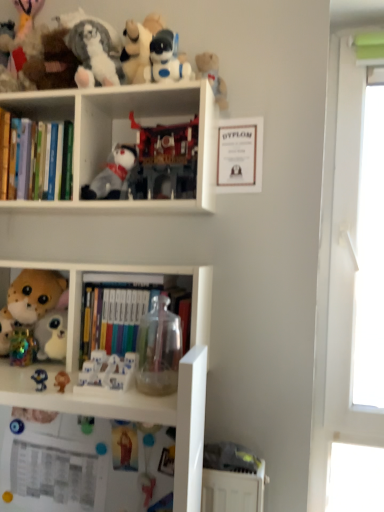
The image size is (384, 512). Find the location of `white plastic robot at upper center, the second toy positioned from the top`. white plastic robot at upper center, the second toy positioned from the top is located at coordinates (165, 59).

The height and width of the screenshot is (512, 384). What do you see at coordinates (111, 174) in the screenshot? I see `white plush toy at center, the eighth toy in the bottom-to-top sequence` at bounding box center [111, 174].

What do you see at coordinates (22, 345) in the screenshot? Image resolution: width=384 pixels, height=512 pixels. I see `shiny metallic piggy bank at lower left, the 5th toy ordered from the bottom` at bounding box center [22, 345].

The width and height of the screenshot is (384, 512). I want to click on shiny metallic piggy bank at lower left, the 7th toy viewed from the top, so click(x=22, y=345).

You are a GUI agent. You are given a task and a screenshot of the screen. Output one action in this format:
    pyautogui.click(x=<x>, y=<y>)
    Task: Click on the fluffy plush toy at left, the seventh toy from the bottom
    
    Given the screenshot: What is the action you would take?
    pyautogui.click(x=38, y=311)

Is white plastic bookshelf at upper center positioned before matte plastic toy at lower center, the first toy positioned from the bottom?

Yes, it is.

Which is behind, point (165, 84) or point (145, 504)?

The point (165, 84) is farther from the camera.

Is white plastic bookshelf at upper center smaller than matte plastic toy at lower center, marked as the 11th toy in a top-to-bottom arrangement?

No, white plastic bookshelf at upper center is not smaller than matte plastic toy at lower center, marked as the 11th toy in a top-to-bottom arrangement.

Is white plastic bookshelf at upper center not within matte plastic toy at lower center, the first toy positioned from the bottom?

Yes.

Does fluffy plush toy at left, the seventh toy from the bottom, lie in front of plastic matte robot at center, the third toy when ordered from top to bottom?

No, the depth of fluffy plush toy at left, the seventh toy from the bottom, is greater than that of plastic matte robot at center, the third toy when ordered from top to bottom.

Does fluffy plush toy at left, the seventh toy from the bottom, turn towards plastic matte robot at center, the third toy when ordered from top to bottom?

No, fluffy plush toy at left, the seventh toy from the bottom, is not turned towards plastic matte robot at center, the third toy when ordered from top to bottom.

Between point (54, 354) and point (153, 181), which one is positioned in front?

The point (153, 181) is closer.

How distant is fluffy plush toy at left, the seventh toy from the bottom, from plastic matte robot at center, the third toy when ordered from top to bottom?

A distance of 17.22 inches exists between fluffy plush toy at left, the seventh toy from the bottom, and plastic matte robot at center, the third toy when ordered from top to bottom.

Considering the sizes of objects matte plastic toy at lower center, the first toy positioned from the bottom, and white plastic bookshelf at upper center in the image provided, who is shorter, matte plastic toy at lower center, the first toy positioned from the bottom, or white plastic bookshelf at upper center?

matte plastic toy at lower center, the first toy positioned from the bottom, is shorter.

Considering the relative positions of matte plastic toy at lower center, marked as the 11th toy in a top-to-bottom arrangement, and white plastic bookshelf at upper center in the image provided, is matte plastic toy at lower center, marked as the 11th toy in a top-to-bottom arrangement, in front of white plastic bookshelf at upper center?

No, matte plastic toy at lower center, marked as the 11th toy in a top-to-bottom arrangement, is further to the viewer.

In terms of width, does matte plastic toy at lower center, the first toy positioned from the bottom, look wider or thinner when compared to white plastic bookshelf at upper center?

Clearly, matte plastic toy at lower center, the first toy positioned from the bottom, has less width compared to white plastic bookshelf at upper center.

Is transparent plastic container at center, marked as the 6th toy in a bottom-to-top arrangement, far from white plastic figurines at center, which appears as the eighth toy when viewed from the top?

transparent plastic container at center, marked as the 6th toy in a bottom-to-top arrangement, is actually quite close to white plastic figurines at center, which appears as the eighth toy when viewed from the top.

Is transparent plastic container at center, which appears as the 6th toy when viewed from the top, taller or shorter than white plastic figurines at center, which appears as the fourth toy when ordered from the bottom?

Considering their sizes, transparent plastic container at center, which appears as the 6th toy when viewed from the top, has more height than white plastic figurines at center, which appears as the fourth toy when ordered from the bottom.

Considering the relative sizes of transparent plastic container at center, marked as the 6th toy in a bottom-to-top arrangement, and white plastic figurines at center, which appears as the fourth toy when ordered from the bottom, in the image provided, is transparent plastic container at center, marked as the 6th toy in a bottom-to-top arrangement, wider than white plastic figurines at center, which appears as the fourth toy when ordered from the bottom,?

Indeed, transparent plastic container at center, marked as the 6th toy in a bottom-to-top arrangement, has a greater width compared to white plastic figurines at center, which appears as the fourth toy when ordered from the bottom.

From a real-world perspective, is transparent plastic container at center, which appears as the 6th toy when viewed from the top, physically below white plastic figurines at center, which appears as the eighth toy when viewed from the top?

Incorrect, from a real-world perspective, transparent plastic container at center, which appears as the 6th toy when viewed from the top, is higher than white plastic figurines at center, which appears as the eighth toy when viewed from the top.

In the scene shown: Is hardcover books at center, positioned as the second book in top-to-bottom order, situated inside hardcover books at left, placed as the second book when sorted from bottom to top, or outside?

hardcover books at center, positioned as the second book in top-to-bottom order, is not inside hardcover books at left, placed as the second book when sorted from bottom to top, it's outside.

Between hardcover books at center, the 1th book positioned from the right, and hardcover books at left, placed as the second book when sorted from bottom to top, which one has smaller width?

With smaller width is hardcover books at left, placed as the second book when sorted from bottom to top.

Considering the sizes of objects hardcover books at center, the second book when ordered from left to right, and hardcover books at left, which is counted as the 1th book, starting from the top, in the image provided, who is shorter, hardcover books at center, the second book when ordered from left to right, or hardcover books at left, which is counted as the 1th book, starting from the top,?

Standing shorter between the two is hardcover books at left, which is counted as the 1th book, starting from the top.

Which object is positioned more to the left, hardcover books at center, positioned as the second book in top-to-bottom order, or hardcover books at left, placed as the second book when sorted from bottom to top?

hardcover books at left, placed as the second book when sorted from bottom to top, is more to the left.

Does fluffy plush penguin at upper left, positioned as the 1th toy in top-to-bottom order, appear on the left side of plastic matte robot at center, the third toy when ordered from top to bottom?

Yes, fluffy plush penguin at upper left, positioned as the 1th toy in top-to-bottom order, is to the left of plastic matte robot at center, the third toy when ordered from top to bottom.

Relative to plastic matte robot at center, the third toy when ordered from top to bottom, is fluffy plush penguin at upper left, the eleventh toy when ordered from bottom to top, in front or behind?

fluffy plush penguin at upper left, the eleventh toy when ordered from bottom to top, is positioned closer to the viewer than plastic matte robot at center, the third toy when ordered from top to bottom.

From the image's perspective, is fluffy plush penguin at upper left, the eleventh toy when ordered from bottom to top, on plastic matte robot at center, which is the 9th toy in bottom-to-top order?

Yes, from the image's perspective, fluffy plush penguin at upper left, the eleventh toy when ordered from bottom to top, is above plastic matte robot at center, which is the 9th toy in bottom-to-top order.

Is fluffy plush penguin at upper left, positioned as the 1th toy in top-to-bottom order, next to plastic matte robot at center, the third toy when ordered from top to bottom?

fluffy plush penguin at upper left, positioned as the 1th toy in top-to-bottom order, and plastic matte robot at center, the third toy when ordered from top to bottom, are not in contact.

Is white plastic robot at upper center, the second toy positioned from the top, positioned with its back to fluffy plush toy at left, the seventh toy from the bottom?

No.

Is white plastic robot at upper center, the second toy positioned from the top, taller than fluffy plush toy at left, marked as the 5th toy in a top-to-bottom arrangement?

No, white plastic robot at upper center, the second toy positioned from the top, is not taller than fluffy plush toy at left, marked as the 5th toy in a top-to-bottom arrangement.

Is white plastic robot at upper center, the second toy positioned from the top, far from fluffy plush toy at left, marked as the 5th toy in a top-to-bottom arrangement?

That's not correct — white plastic robot at upper center, the second toy positioned from the top, is a little close to fluffy plush toy at left, marked as the 5th toy in a top-to-bottom arrangement.

Is point (158, 70) closer or farther from the camera than point (39, 303)?

Point (158, 70) appears to be closer to the viewer than point (39, 303).

Where is `the 5th toy to the right of the white plastic bookshelf at upper center, starting your count from the anchor`? the 5th toy to the right of the white plastic bookshelf at upper center, starting your count from the anchor is located at coordinates (146, 487).

Locate an element on the screen. Image resolution: width=384 pixels, height=512 pixels. the 8th toy to the left of the plastic matte robot at center, the third toy when ordered from top to bottom, starting your count from the anchor is located at coordinates (38, 311).

Estimate the real-world distances between objects in this image. Which object is further from white plastic figurines at center, which appears as the fourth toy when ordered from the bottom, matte blue plush at lower left, which is the third toy in bottom-to-top order, or matte plastic toy at lower center, the first toy positioned from the bottom?

matte plastic toy at lower center, the first toy positioned from the bottom.

Considering their positions, is white plastic bookshelf at upper center positioned further to fluffy plush penguin at upper left, positioned as the 1th toy in top-to-bottom order, than matte blue plush at lower left, marked as the ninth toy in a top-to-bottom arrangement?

matte blue plush at lower left, marked as the ninth toy in a top-to-bottom arrangement, lies further to fluffy plush penguin at upper left, positioned as the 1th toy in top-to-bottom order, than the other object.

Considering their positions, is matte plastic toy at lower center, marked as the 11th toy in a top-to-bottom arrangement, positioned further to shiny metallic piggy bank at lower left, the 5th toy ordered from the bottom, than fluffy plush toy at left, the seventh toy from the bottom?

matte plastic toy at lower center, marked as the 11th toy in a top-to-bottom arrangement.

Based on their spatial positions, is hardcover books at left, which is counted as the 1th book, starting from the top, or transparent plastic window at right closer to fluffy plush penguin at upper left, the eleventh toy when ordered from bottom to top?

Based on the image, hardcover books at left, which is counted as the 1th book, starting from the top, appears to be nearer to fluffy plush penguin at upper left, the eleventh toy when ordered from bottom to top.

When comparing their distances from white plush toy at center, the eighth toy in the bottom-to-top sequence, does hardcover books at left, placed as the second book when sorted from bottom to top, or white plastic figurines at center, which appears as the fourth toy when ordered from the bottom, seem further?

The object further to white plush toy at center, the eighth toy in the bottom-to-top sequence, is white plastic figurines at center, which appears as the fourth toy when ordered from the bottom.

Looking at the image, which one is located further to white plastic robot at upper center, the second toy positioned from the top, white plastic bookshelf at upper center or white plastic figurines at center, which appears as the fourth toy when ordered from the bottom?

white plastic figurines at center, which appears as the fourth toy when ordered from the bottom.

Estimate the real-world distances between objects in this image. Which object is closer to hardcover books at left, which is counted as the 1th book, starting from the top, white plastic robot at upper center, the second toy positioned from the top, or transparent plastic window at right?

white plastic robot at upper center, the second toy positioned from the top, is closer to hardcover books at left, which is counted as the 1th book, starting from the top.

When comparing their distances from matte plastic toy at lower center, the first toy positioned from the bottom, does matte blue plush at lower left, marked as the ninth toy in a top-to-bottom arrangement, or fluffy plush penguin at upper left, positioned as the 1th toy in top-to-bottom order, seem further?

The object further to matte plastic toy at lower center, the first toy positioned from the bottom, is fluffy plush penguin at upper left, positioned as the 1th toy in top-to-bottom order.

You are a GUI agent. You are given a task and a screenshot of the screen. Output one action in this format:
    pyautogui.click(x=<x>, y=<y>)
    Task: Click on the book between hardcover books at left, the 2th book from the right, and matte blue plush at lower left, marked as the ninth toy in a top-to-bottom arrangement, from top to bottom
    The image size is (384, 512).
    Given the screenshot: What is the action you would take?
    pyautogui.click(x=113, y=316)

Find the location of a particular element. This screenshot has width=384, height=512. book between white plush toy at center, which is counted as the 4th toy, starting from the top, and transparent plastic container at center, marked as the 6th toy in a bottom-to-top arrangement, in the vertical direction is located at coordinates (113, 316).

Identify the location of toy between plastic matte robot at center, the third toy when ordered from top to bottom, and transparent plastic window at right. (159, 349).

Identify the location of window screen between fluffy plush penguin at upper left, positioned as the 1th toy in top-to-bottom order, and matte plastic toy at lower center, the first toy positioned from the bottom, vertically. (338, 274).